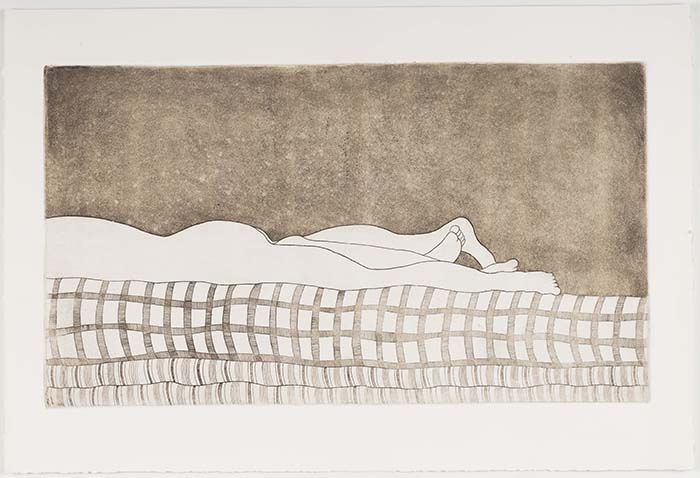
The width and height of the screenshot is (700, 478). In order to click on checked sheet in this screenshot , I will do `click(239, 317)`.